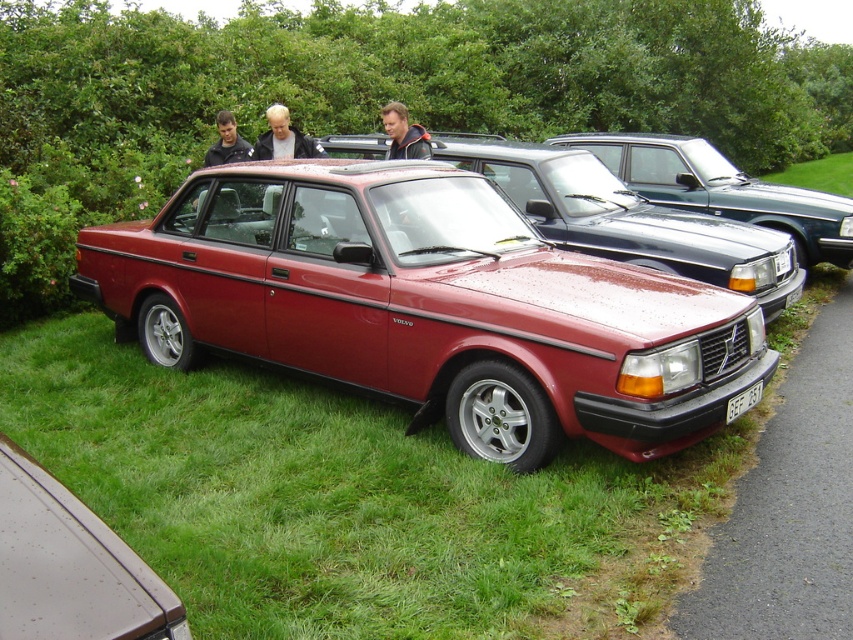
Is metallic red sedan at center bigger than green grass at lower right?

No, metallic red sedan at center is not bigger than green grass at lower right.

Describe the element at coordinates (628, 220) in the screenshot. I see `metallic red sedan at center` at that location.

The height and width of the screenshot is (640, 853). What are the coordinates of `metallic red sedan at center` in the screenshot? It's located at (628, 220).

Which is more to the left, matte black jacket at upper center or white plastic license plate at center?

matte black jacket at upper center is more to the left.

Is matte black jacket at upper center wider than white plastic license plate at center?

Yes.

In order to click on matte black jacket at upper center in this screenshot , I will do `click(227, 141)`.

In order to click on matte black jacket at upper center in this screenshot , I will do `click(227, 141)`.

Does blonde hair at center lie in front of matte black jacket at upper center?

Yes, blonde hair at center is in front of matte black jacket at upper center.

Can you confirm if blonde hair at center is positioned above matte black jacket at upper center?

No.

Image resolution: width=853 pixels, height=640 pixels. What do you see at coordinates (283, 138) in the screenshot? I see `blonde hair at center` at bounding box center [283, 138].

This screenshot has height=640, width=853. Identify the location of blonde hair at center. (283, 138).